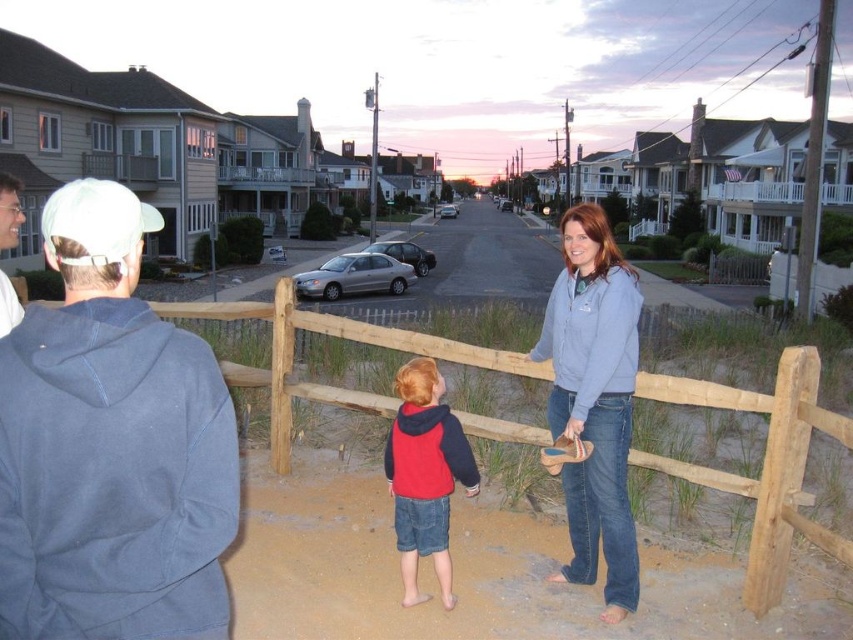
You are standing behind the wooden fence in the suburban scene. You see the denim jacket at center and the matte gray hoodie at left. Which one is closer to the fence?

The matte gray hoodie at left is closer to the fence because it is positioned to the left of the denim jacket at center, and in the scene, left items are typically closer to the viewer.

Please look at the image and locate the point at coordinates (111, 445). What object in the scene does this point correspond to?

The point at coordinates (111, 445) corresponds to the light blue fleece jacket at left.